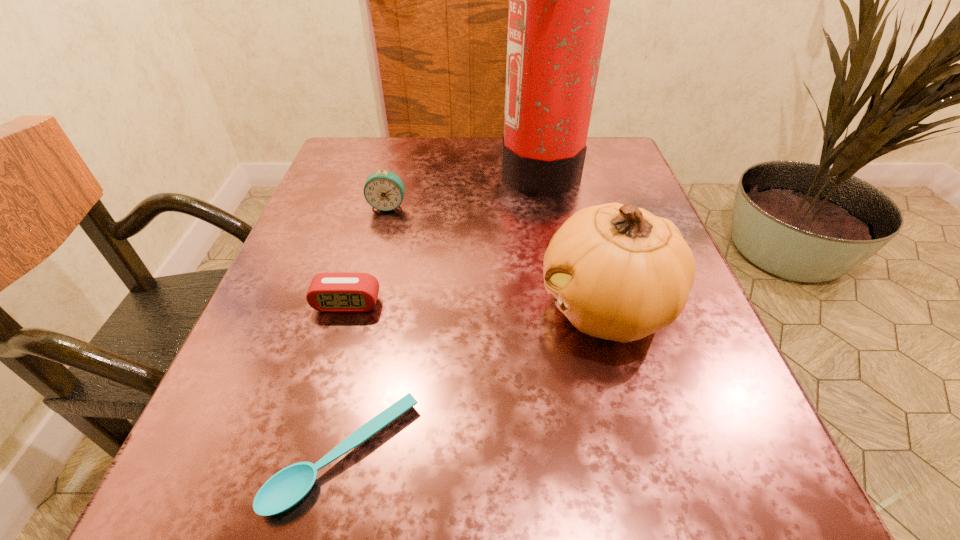
This screenshot has width=960, height=540. Find the location of `vacant space located on the front side of the tallest object`. vacant space located on the front side of the tallest object is located at coordinates (358, 169).

The width and height of the screenshot is (960, 540). Identify the location of vacant area situated 0.050m on the front face of the second tallest object. click(x=507, y=307).

Locate an element on the screen. vacant area located 0.140m on the front face of the second tallest object is located at coordinates (451, 307).

Find the location of `vacant region located 0.220m on the front face of the second tallest object`. vacant region located 0.220m on the front face of the second tallest object is located at coordinates (401, 307).

Identify the location of free space located on the front-facing side of the farther alarm clock. The image size is (960, 540). (349, 355).

Find the location of `free space located on the front-facing side of the shorter alarm clock`. free space located on the front-facing side of the shorter alarm clock is located at coordinates (330, 361).

I want to click on free space located on the right of the nearest object, so click(x=570, y=455).

The image size is (960, 540). Find the location of `object situated at the far edge`. object situated at the far edge is located at coordinates (559, 0).

You are a GUI agent. You are given a task and a screenshot of the screen. Output one action in this format:
    pyautogui.click(x=<x>, y=<y>)
    Task: Click on the object positioned at the near edge
    The width and height of the screenshot is (960, 540).
    Given the screenshot: What is the action you would take?
    pyautogui.click(x=286, y=488)

The width and height of the screenshot is (960, 540). Find the location of `spoon present at the left edge`. spoon present at the left edge is located at coordinates (286, 488).